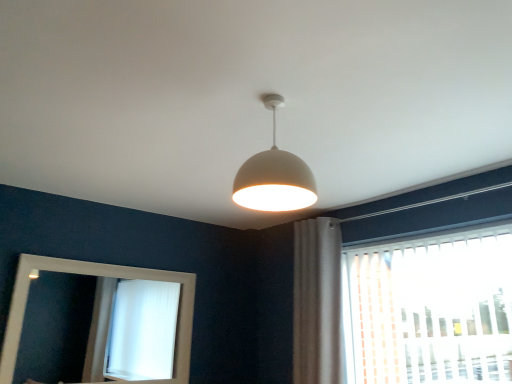
This screenshot has width=512, height=384. Find the location of `white plastic blinds at right`. white plastic blinds at right is located at coordinates (430, 309).

Between white plastic blinds at right and white wooden mirror at lower left, which one appears on the left side from the viewer's perspective?

Positioned to the left is white wooden mirror at lower left.

Looking at this image, is white plastic blinds at right oriented towards white wooden mirror at lower left?

No, white plastic blinds at right is not facing towards white wooden mirror at lower left.

Does white plastic blinds at right have a greater width compared to white wooden mirror at lower left?

Correct, the width of white plastic blinds at right exceeds that of white wooden mirror at lower left.

Can you tell me how much white plastic blinds at right and white wooden mirror at lower left differ in facing direction?

The angle between the facing direction of white plastic blinds at right and the facing direction of white wooden mirror at lower left is 90.2 degrees.

Considering the points (316, 261) and (267, 202), which point is in front, point (316, 261) or point (267, 202)?

Point (267, 202)

Is there a large distance between white fabric curtain at right and white matte/porcelain lampshade at center?

Indeed, white fabric curtain at right is not near white matte/porcelain lampshade at center.

Is white fabric curtain at right at the left side of white matte/porcelain lampshade at center?

No, white fabric curtain at right is not to the left of white matte/porcelain lampshade at center.

How distant is white fabric curtain at right from white matte/porcelain lampshade at center?

They are 1.36 meters apart.

Does white plastic blinds at right have a greater height compared to white fabric curtain at right?

No, white plastic blinds at right is not taller than white fabric curtain at right.

Is the depth of white plastic blinds at right greater than that of white fabric curtain at right?

No, the depth of white plastic blinds at right is less than that of white fabric curtain at right.

How many degrees apart are the facing directions of white plastic blinds at right and white fabric curtain at right?

The facing directions of white plastic blinds at right and white fabric curtain at right are 0.00241 degrees apart.

How much distance is there between white matte/porcelain lampshade at center and white plastic blinds at right?

white matte/porcelain lampshade at center and white plastic blinds at right are 4.36 feet apart from each other.

Can white plastic blinds at right be found inside white matte/porcelain lampshade at center?

That's incorrect, white plastic blinds at right is not inside white matte/porcelain lampshade at center.

Which of these two, white matte/porcelain lampshade at center or white plastic blinds at right, stands shorter?

white matte/porcelain lampshade at center.

Does white matte/porcelain lampshade at center have a greater width compared to white plastic blinds at right?

Correct, the width of white matte/porcelain lampshade at center exceeds that of white plastic blinds at right.

From the picture: Is white matte/porcelain lampshade at center in contact with white wooden mirror at lower left?

No, white matte/porcelain lampshade at center is not next to white wooden mirror at lower left.

Does white matte/porcelain lampshade at center have a greater width compared to white wooden mirror at lower left?

Result: Indeed, white matte/porcelain lampshade at center has a greater width compared to white wooden mirror at lower left.

I want to click on lamp lying on the right of white wooden mirror at lower left, so click(274, 175).

Considering the sizes of objects white wooden mirror at lower left and white matte/porcelain lampshade at center in the image provided, who is smaller, white wooden mirror at lower left or white matte/porcelain lampshade at center?

Smaller between the two is white matte/porcelain lampshade at center.

Considering the sizes of objects white wooden mirror at lower left and white matte/porcelain lampshade at center in the image provided, who is wider, white wooden mirror at lower left or white matte/porcelain lampshade at center?

white matte/porcelain lampshade at center.

Does point (42, 280) appear closer or farther from the camera than point (279, 95)?

Point (42, 280) is positioned farther from the camera compared to point (279, 95).

Which object is positioned more to the right, white fabric curtain at right or white plastic blinds at right?

Positioned to the right is white plastic blinds at right.

Relative to white plastic blinds at right, is white fabric curtain at right in front or behind?

Clearly, white fabric curtain at right is behind white plastic blinds at right.

Is white fabric curtain at right touching white plastic blinds at right?

No.

Does white fabric curtain at right have a lesser height compared to white plastic blinds at right?

Incorrect, the height of white fabric curtain at right does not fall short of that of white plastic blinds at right.

This screenshot has height=384, width=512. Identify the location of window lying on the right of white wooden mirror at lower left. (430, 309).

Locate an element on the screen. This screenshot has height=384, width=512. curtain that appears behind the white matte/porcelain lampshade at center is located at coordinates (317, 302).

Looking at the image, which one is located closer to white fabric curtain at right, white wooden mirror at lower left or white matte/porcelain lampshade at center?

white matte/porcelain lampshade at center lies closer to white fabric curtain at right than the other object.

Looking at this image, from the image, which object appears to be nearer to white wooden mirror at lower left, white fabric curtain at right or white plastic blinds at right?

white fabric curtain at right is closer to white wooden mirror at lower left.

Considering their positions, is white wooden mirror at lower left positioned further to white matte/porcelain lampshade at center than white fabric curtain at right?

white wooden mirror at lower left is further to white matte/porcelain lampshade at center.

When comparing their distances from white plastic blinds at right, does white matte/porcelain lampshade at center or white wooden mirror at lower left seem closer?

white matte/porcelain lampshade at center is closer to white plastic blinds at right.

Estimate the real-world distances between objects in this image. Which object is closer to white matte/porcelain lampshade at center, white plastic blinds at right or white wooden mirror at lower left?

white plastic blinds at right is closer to white matte/porcelain lampshade at center.

Estimate the real-world distances between objects in this image. Which object is further from white fabric curtain at right, white matte/porcelain lampshade at center or white wooden mirror at lower left?

The object further to white fabric curtain at right is white wooden mirror at lower left.

Considering their positions, is white plastic blinds at right positioned further to white wooden mirror at lower left than white fabric curtain at right?

white plastic blinds at right lies further to white wooden mirror at lower left than the other object.

Estimate the real-world distances between objects in this image. Which object is closer to white plastic blinds at right, white fabric curtain at right or white wooden mirror at lower left?

Based on the image, white fabric curtain at right appears to be nearer to white plastic blinds at right.

Locate an element on the screen. The width and height of the screenshot is (512, 384). lamp between white wooden mirror at lower left and white plastic blinds at right in the horizontal direction is located at coordinates [274, 175].

Locate an element on the screen. This screenshot has height=384, width=512. lamp between white wooden mirror at lower left and white fabric curtain at right from left to right is located at coordinates (274, 175).

This screenshot has width=512, height=384. In order to click on curtain between white wooden mirror at lower left and white plastic blinds at right from left to right in this screenshot , I will do `click(317, 302)`.

The height and width of the screenshot is (384, 512). What are the coordinates of `window located between white matte/porcelain lampshade at center and white fabric curtain at right in the depth direction` in the screenshot? It's located at (430, 309).